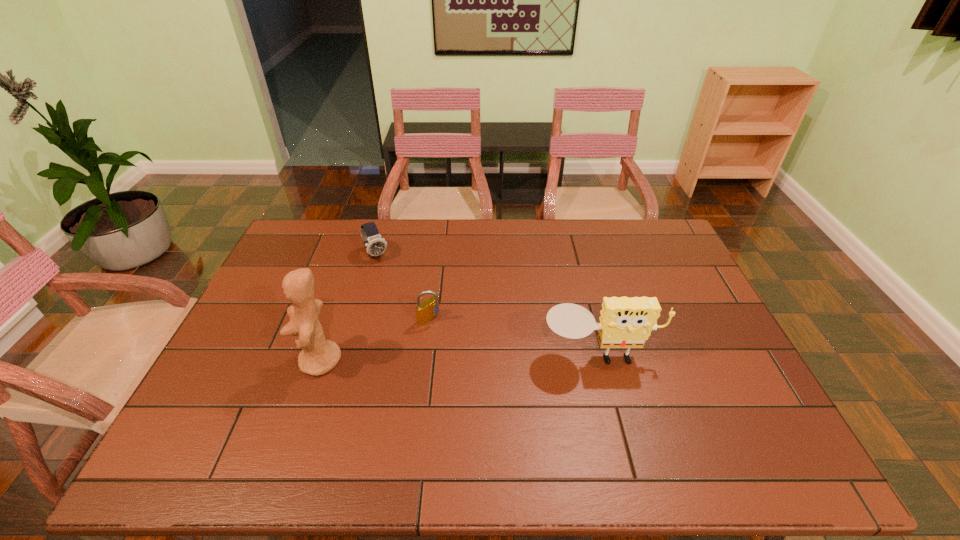
Locate an element on the screen. The image size is (960, 540). unoccupied area between the figurine and the watch is located at coordinates (348, 308).

Identify which object is the second nearest to the padlock. Please provide its 2D coordinates. Your answer should be formatted as a tuple, i.e. [(x, y)], where the tuple contains the x and y coordinates of a point satisfying the conditions above.

[(375, 245)]

This screenshot has width=960, height=540. Identify the location of object identified as the closest to the second farthest object. (319, 356).

Find the location of a particular element. This screenshot has width=960, height=540. free space in the image that satisfies the following two spatial constraints: 1. on the front side of the farthest object; 2. on the right side of the second farthest object is located at coordinates (358, 319).